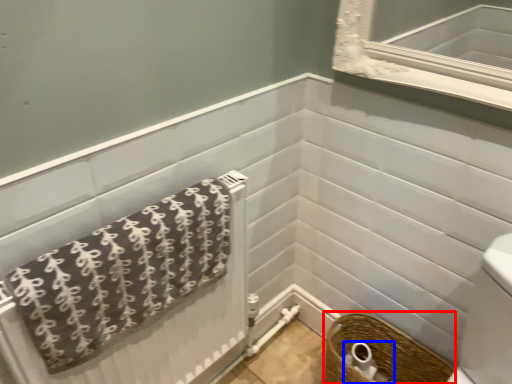
Question: Which object is closer to the camera taking this photo, basket (highlighted by a red box) or toilet paper (highlighted by a blue box)?

Choices:
 (A) basket
 (B) toilet paper

Answer: (A)